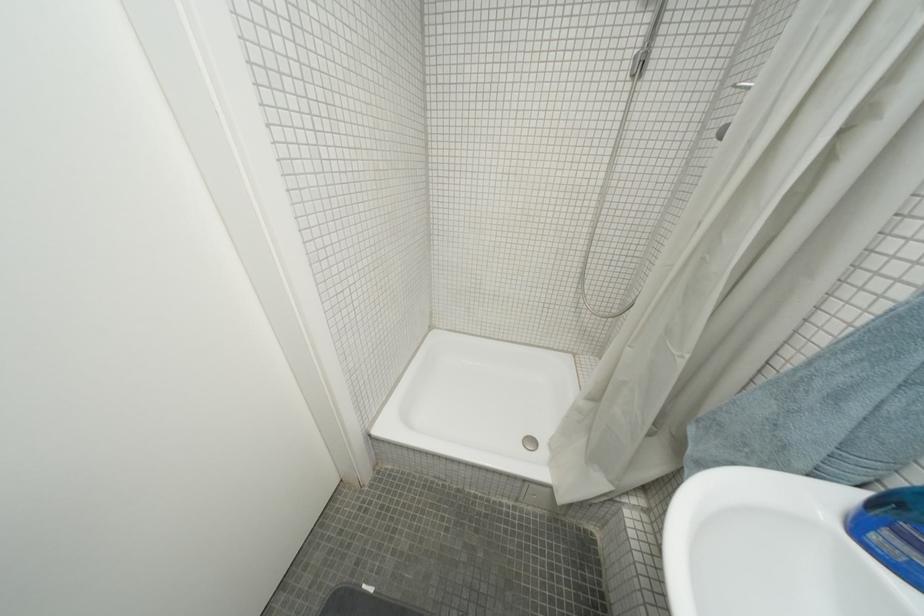
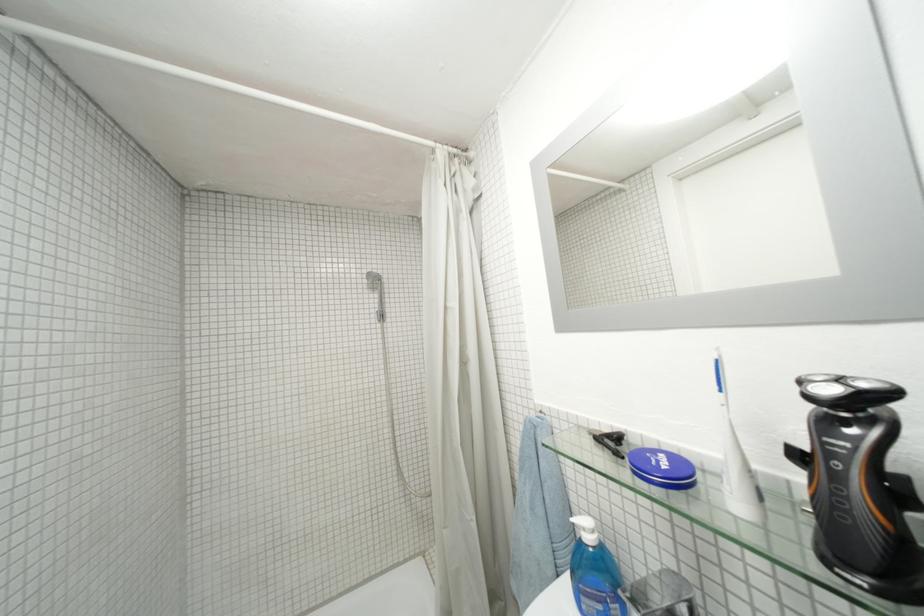
Find the pixel in the second image that matches point (627, 57) in the first image.

(375, 314)